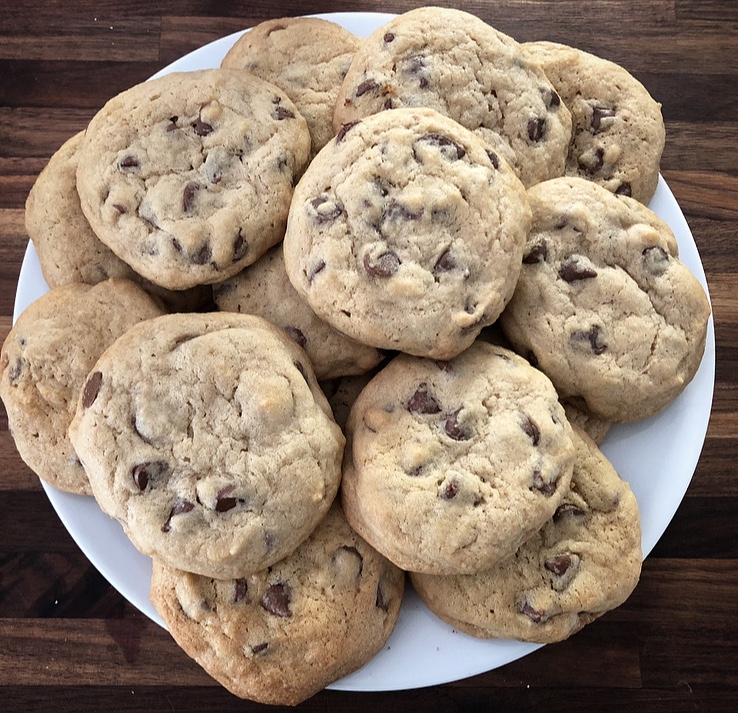
The height and width of the screenshot is (713, 738). What are the coordinates of `table` in the screenshot? It's located at (72, 83).